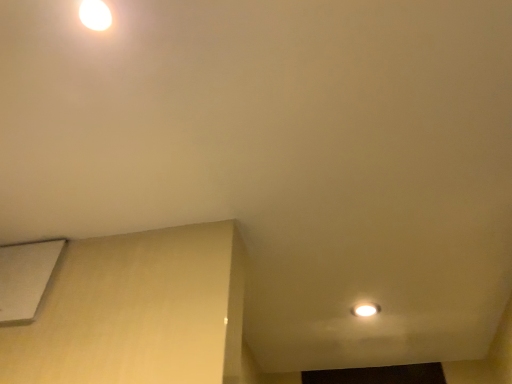
Question: Would you say white glossy light fixture at upper left is to the left or to the right of white matte lift at lower left in the picture?

Choices:
 (A) right
 (B) left

Answer: (A)

Question: From a real-world perspective, is white glossy light fixture at upper left above or below white matte lift at lower left?

Choices:
 (A) above
 (B) below

Answer: (A)

Question: Considering the positions of white glossy light fixture at upper left and white matte lift at lower left in the image, is white glossy light fixture at upper left taller or shorter than white matte lift at lower left?

Choices:
 (A) short
 (B) tall

Answer: (A)

Question: Considering the positions of point (51, 274) and point (104, 21), is point (51, 274) closer or farther from the camera than point (104, 21)?

Choices:
 (A) farther
 (B) closer

Answer: (A)

Question: In terms of size, does white matte lift at lower left appear bigger or smaller than white glossy light fixture at upper left?

Choices:
 (A) small
 (B) big

Answer: (B)

Question: Is white matte lift at lower left to the left or to the right of white glossy light fixture at upper left in the image?

Choices:
 (A) right
 (B) left

Answer: (B)

Question: Which is correct: white matte lift at lower left is inside white glossy light fixture at upper left, or outside of it?

Choices:
 (A) outside
 (B) inside

Answer: (A)